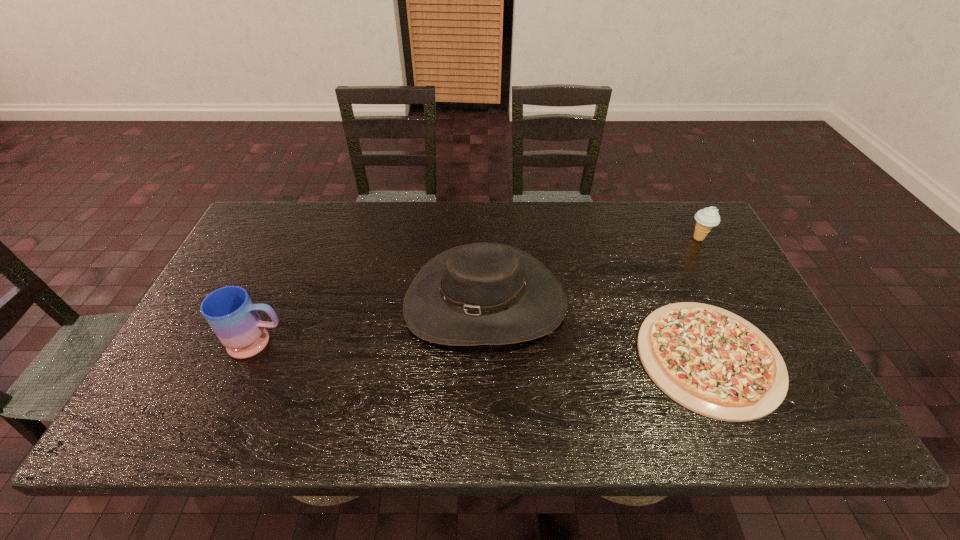
You are a GUI agent. You are given a task and a screenshot of the screen. Output one action in this format:
    pyautogui.click(x=<x>, y=<y>)
    Task: Click on the object positioned at the near edge
    The height and width of the screenshot is (540, 960).
    Given the screenshot: What is the action you would take?
    pyautogui.click(x=711, y=361)

The height and width of the screenshot is (540, 960). I want to click on object present at the left edge, so click(x=230, y=312).

Where is `icecream that is at the right edge`? This screenshot has height=540, width=960. icecream that is at the right edge is located at coordinates (706, 218).

Where is `pizza present at the right edge`? The width and height of the screenshot is (960, 540). pizza present at the right edge is located at coordinates (711, 361).

Locate an element on the screen. object positioned at the far right corner is located at coordinates (706, 218).

Where is `object present at the near right corner`? The image size is (960, 540). object present at the near right corner is located at coordinates (711, 361).

The width and height of the screenshot is (960, 540). Find the location of `vacant space at the far edge of the desktop`. vacant space at the far edge of the desktop is located at coordinates (394, 243).

In the image, there is a desktop. Where is `free space at the near edge`? free space at the near edge is located at coordinates (568, 415).

The image size is (960, 540). What are the coordinates of `vacant region at the left edge of the desktop` in the screenshot? It's located at (183, 347).

In the image, there is a desktop. Identify the location of vacant area at the right edge. The width and height of the screenshot is (960, 540). (698, 253).